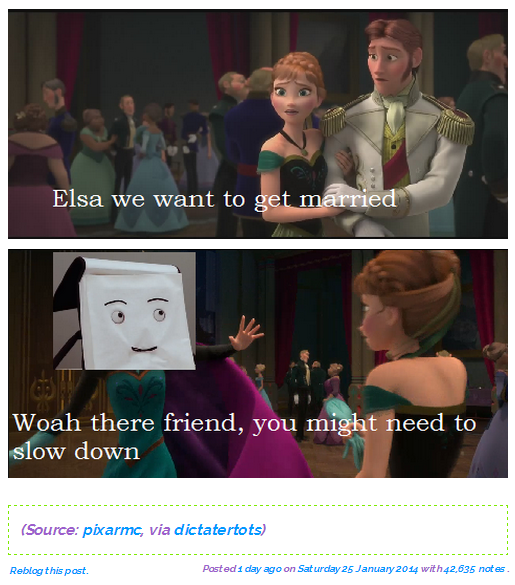
Find the location of a particular element. curtain is located at coordinates pyautogui.click(x=231, y=55), pyautogui.click(x=63, y=41), pyautogui.click(x=291, y=34), pyautogui.click(x=381, y=13), pyautogui.click(x=483, y=20), pyautogui.click(x=486, y=288), pyautogui.click(x=377, y=357), pyautogui.click(x=278, y=323), pyautogui.click(x=346, y=302).